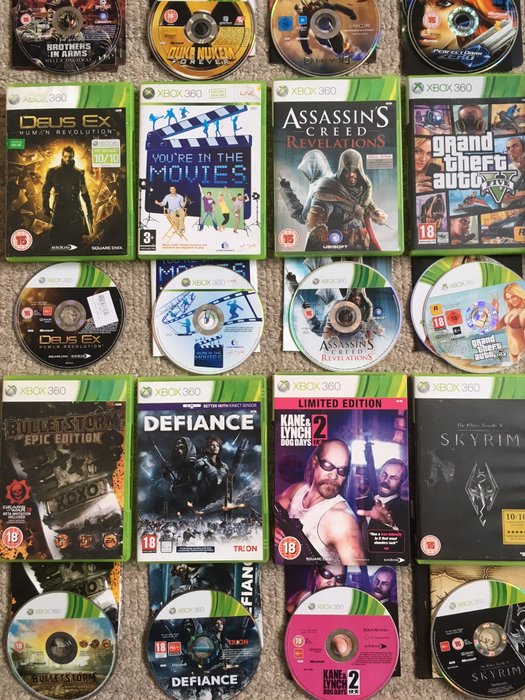
You are a GUI agent. You are given a task and a screenshot of the screen. Output one action in this format:
    pyautogui.click(x=<x>, y=<y>)
    Task: Click on the xbox game cases
    This screenshot has width=525, height=700.
    Given the screenshot: What is the action you would take?
    pyautogui.click(x=68, y=167), pyautogui.click(x=206, y=173), pyautogui.click(x=348, y=174), pyautogui.click(x=468, y=164), pyautogui.click(x=468, y=498), pyautogui.click(x=325, y=490), pyautogui.click(x=189, y=491), pyautogui.click(x=72, y=486)